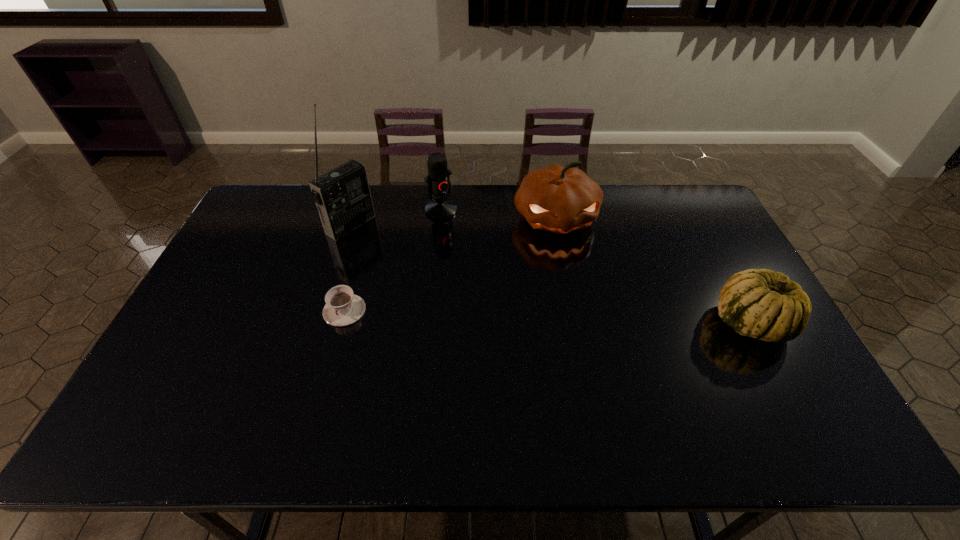
This screenshot has height=540, width=960. What are the coordinates of `free spot on the desktop that is between the shortest object and the gourd and is positioned on the side of the microphone with the red ring` in the screenshot? It's located at (536, 316).

This screenshot has width=960, height=540. In order to click on vacant space on the desktop that is between the shortest object and the rightmost object and is positioned on the front face of the pumpkin in this screenshot , I will do `click(583, 318)`.

The width and height of the screenshot is (960, 540). I want to click on free space on the desktop that is between the teacup and the gourd and is positioned on the display of the radio receiver, so click(495, 315).